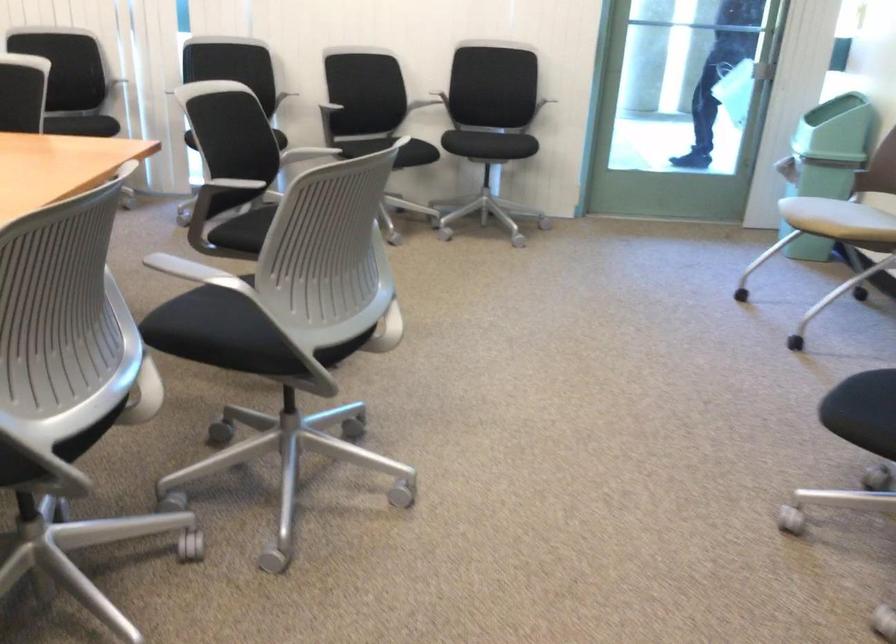
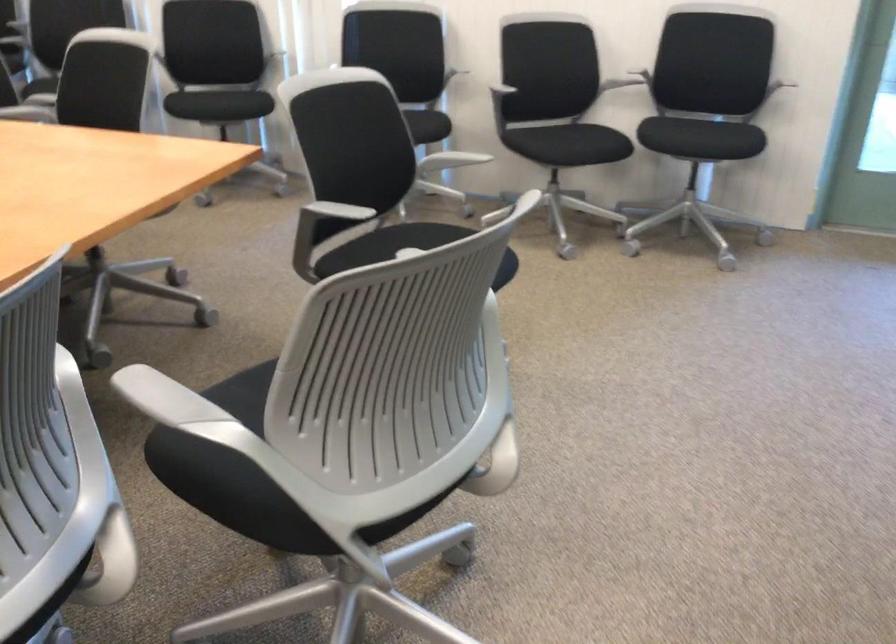
The point at [236,182] is marked in the first image. Where is the corresponding point in the second image?

(332, 212)